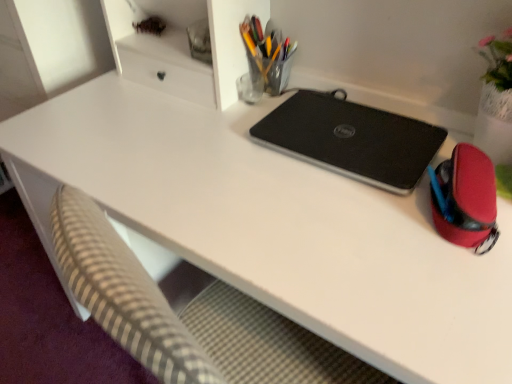
Question: Based on their sizes in the image, would you say black matte laptop at center is bigger or smaller than rubberized red pouch at right, which is the 2th stationery in left-to-right order?

Choices:
 (A) small
 (B) big

Answer: (B)

Question: Considering the positions of black matte laptop at center and rubberized red pouch at right, the 1th stationery when ordered from right to left, in the image, is black matte laptop at center wider or thinner than rubberized red pouch at right, the 1th stationery when ordered from right to left,?

Choices:
 (A) wide
 (B) thin

Answer: (A)

Question: Estimate the real-world distances between objects in this image. Which object is closer to the rubberized red pouch at right, which ranks as the second stationery in top-to-bottom order?

Choices:
 (A) black matte laptop at center
 (B) translucent glass pen holder at upper center, positioned as the first stationery in back-to-front order

Answer: (A)

Question: Estimate the real-world distances between objects in this image. Which object is closer to the rubberized red pouch at right, arranged as the 1th stationery when viewed from the front?

Choices:
 (A) black matte laptop at center
 (B) translucent glass pen holder at upper center, the 2th stationery in the front-to-back sequence

Answer: (A)